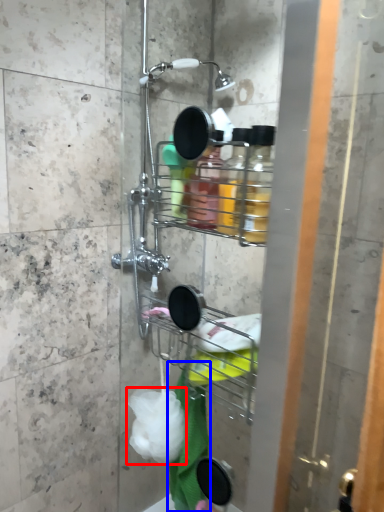
Question: Which of the following is the closest to the observer, plastic (highlighted by a red box) or bath towel (highlighted by a blue box)?

Choices:
 (A) plastic
 (B) bath towel

Answer: (A)